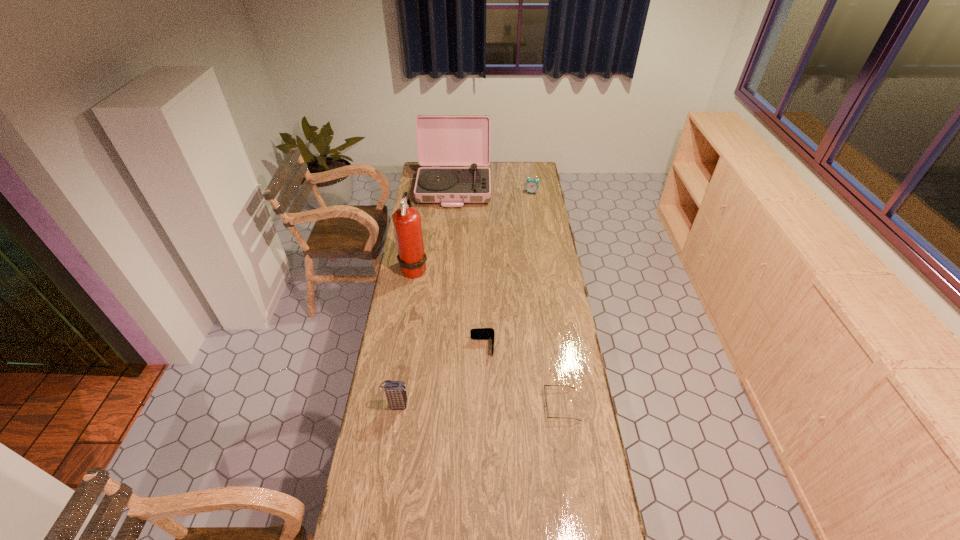
I want to click on record player situated at the left edge, so click(442, 140).

Identify the location of clutch bag that is at the left edge. (395, 391).

Identify the location of alarm clock located in the right edge section of the desktop. The height and width of the screenshot is (540, 960). (532, 185).

This screenshot has height=540, width=960. Identify the location of spectacles at the right edge. (544, 385).

The height and width of the screenshot is (540, 960). Find the location of `object that is at the far left corner`. object that is at the far left corner is located at coordinates (442, 140).

Locate an element on the screen. Image resolution: width=960 pixels, height=540 pixels. vacant region at the left edge of the desktop is located at coordinates (414, 341).

This screenshot has width=960, height=540. I want to click on vacant space at the right edge of the desktop, so click(558, 272).

Where is `free region at the far right corner of the desktop`? Image resolution: width=960 pixels, height=540 pixels. free region at the far right corner of the desktop is located at coordinates (522, 171).

Find the location of a particular element. Image resolution: width=960 pixels, height=540 pixels. vacant space that is in between the fourth tallest object and the fourth shortest object is located at coordinates (465, 299).

The width and height of the screenshot is (960, 540). Identify the location of free point between the alarm clock and the record player. (492, 190).